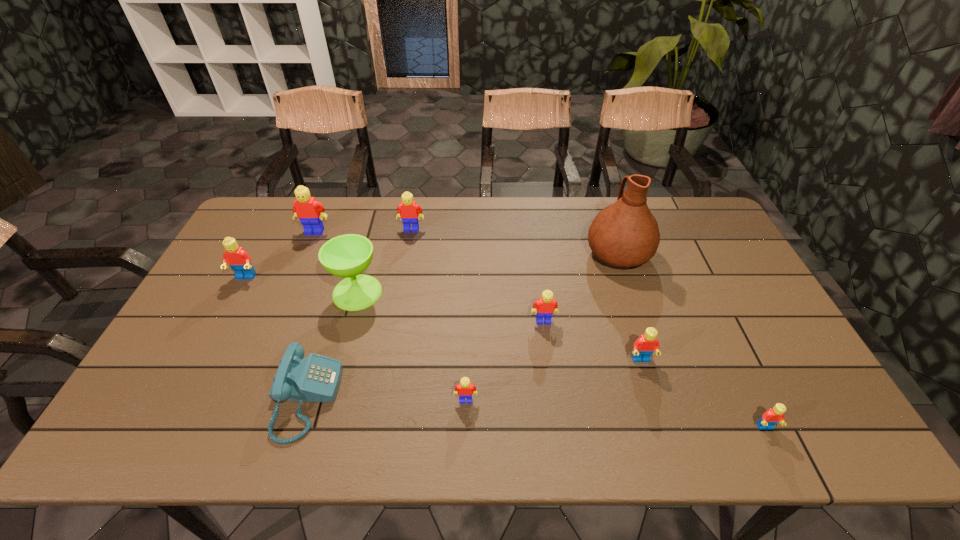
The height and width of the screenshot is (540, 960). I want to click on the second nearest red Lego, so click(x=644, y=347).

Identify the location of the fifth farthest Lego. The width and height of the screenshot is (960, 540). (644, 347).

You are a GUI agent. You are given a task and a screenshot of the screen. Output one action in this format:
    pyautogui.click(x=<x>, y=<y>)
    Task: Click on the fifth object from right to left
    
    Given the screenshot: What is the action you would take?
    pyautogui.click(x=465, y=389)

Locate an element on the screen. The image size is (960, 540). the nearest yellow Lego is located at coordinates (465, 389).

The width and height of the screenshot is (960, 540). Identify the location of the smallest red Lego. (774, 415).

Where is `the rightmost object`? Image resolution: width=960 pixels, height=540 pixels. the rightmost object is located at coordinates (774, 415).

In order to click on blue telephone in this screenshot , I will do `click(316, 378)`.

In order to click on free space located 0.060m on the side of the tallest object with the handle in this screenshot , I will do `click(607, 220)`.

Locate an element on the screen. The height and width of the screenshot is (540, 960). vacant space located on the side of the tallest object with the handle is located at coordinates (603, 206).

This screenshot has width=960, height=540. Identify the location of vacant space situated on the side of the tallest object with the handle. (607, 218).